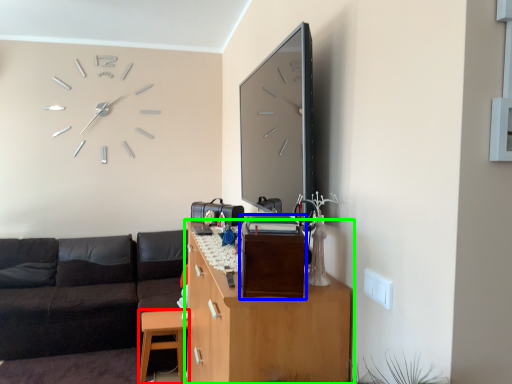
Question: Considering the real-world distances, which object is closest to table (highlighted by a red box)? file cabinet (highlighted by a blue box) or cabinetry (highlighted by a green box).

Choices:
 (A) file cabinet
 (B) cabinetry

Answer: (B)